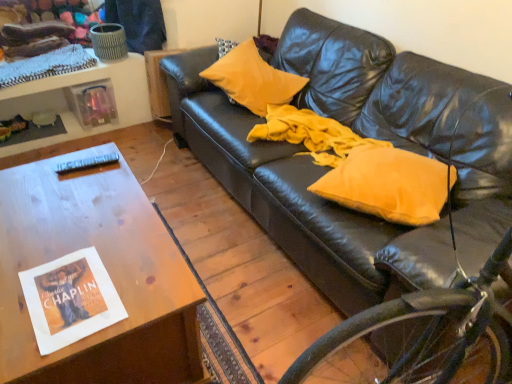
What is the approximate height of black plastic remote control at upper left?

black plastic remote control at upper left is 3.34 centimeters in height.

Where is `black plastic remote control at upper left`? This screenshot has height=384, width=512. black plastic remote control at upper left is located at coordinates (86, 163).

The height and width of the screenshot is (384, 512). What do you see at coordinates (70, 299) in the screenshot?
I see `white paper magazine at lower left` at bounding box center [70, 299].

Measure the distance between woodenwoodentable at left and camera.

The distance of woodenwoodentable at left from camera is 92.90 centimeters.

Identify the location of leather couch at center. This screenshot has height=384, width=512. (412, 115).

Considering the relative positions of yellow fabric pillow at center, which is the 1th pillow in front-to-back order, and yellow matte pillow at upper center, arranged as the 1th pillow when viewed from the back, in the image provided, is yellow fabric pillow at center, which is the 1th pillow in front-to-back order, to the right of yellow matte pillow at upper center, arranged as the 1th pillow when viewed from the back, from the viewer's perspective?

Correct, you'll find yellow fabric pillow at center, which is the 1th pillow in front-to-back order, to the right of yellow matte pillow at upper center, arranged as the 1th pillow when viewed from the back.

Does yellow fabric pillow at center, which is the 2th pillow in back-to-front order, have a larger size compared to yellow matte pillow at upper center, the 1th pillow positioned from the left?

No.

Where is `pillow that is on the left side of yellow fabric pillow at center, which is the 2th pillow in back-to-front order`? pillow that is on the left side of yellow fabric pillow at center, which is the 2th pillow in back-to-front order is located at coordinates (253, 79).

Does point (435, 187) lie in front of point (246, 55)?

That is True.

Are yellow matte pillow at upper center, arranged as the 1th pillow when viewed from the back, and yellow fabric pillow at center, which is the 2th pillow from top to bottom, far apart?

No.

The height and width of the screenshot is (384, 512). Find the location of `pillow on the right of yellow matte pillow at upper center, the 1th pillow positioned from the left`. pillow on the right of yellow matte pillow at upper center, the 1th pillow positioned from the left is located at coordinates (389, 184).

What's the angular difference between yellow matte pillow at upper center, the first pillow positioned from the top, and yellow fabric pillow at center, which is the second pillow from left to right,'s facing directions?

The facing directions of yellow matte pillow at upper center, the first pillow positioned from the top, and yellow fabric pillow at center, which is the second pillow from left to right, are 8.66 degrees apart.

How many degrees apart are the facing directions of yellow matte pillow at upper center, which is the 2th pillow in right-to-left order, and black plastic remote control at upper left?

The facing directions of yellow matte pillow at upper center, which is the 2th pillow in right-to-left order, and black plastic remote control at upper left are 26.3 degrees apart.

From the picture: From a real-world perspective, is yellow matte pillow at upper center, which is the 2th pillow in right-to-left order, physically located above or below black plastic remote control at upper left?

yellow matte pillow at upper center, which is the 2th pillow in right-to-left order, is situated lower than black plastic remote control at upper left in the real world.

Which is more to the right, yellow matte pillow at upper center, which ranks as the 2th pillow in front-to-back order, or black plastic remote control at upper left?

Positioned to the right is yellow matte pillow at upper center, which ranks as the 2th pillow in front-to-back order.

Is black plastic remote control at upper left located within yellow matte pillow at upper center, the first pillow positioned from the top?

That's incorrect, black plastic remote control at upper left is not inside yellow matte pillow at upper center, the first pillow positioned from the top.

Would you consider yellow fabric pillow at center, which is the 2th pillow in back-to-front order, to be distant from black plastic remote control at upper left?

yellow fabric pillow at center, which is the 2th pillow in back-to-front order, is positioned a significant distance from black plastic remote control at upper left.

From a real-world perspective, which is physically below, yellow fabric pillow at center, which is the 2th pillow in back-to-front order, or black plastic remote control at upper left?

From a 3D spatial view, yellow fabric pillow at center, which is the 2th pillow in back-to-front order, is below.

Can you confirm if yellow fabric pillow at center, which is the 2th pillow from top to bottom, is bigger than black plastic remote control at upper left?

Yes, yellow fabric pillow at center, which is the 2th pillow from top to bottom, is bigger than black plastic remote control at upper left.

Which point is more distant from viewer, (411,197) or (74,165)?

Positioned behind is point (74,165).

Which object is closer to the camera, white paper magazine at lower left or black plastic remote control at upper left?

white paper magazine at lower left is closer to the camera.

Is white paper magazine at lower left not near black plastic remote control at upper left?

No, white paper magazine at lower left is not far from black plastic remote control at upper left.

How different are the orientations of white paper magazine at lower left and black plastic remote control at upper left in degrees?

There is a 101-degree angle between the facing directions of white paper magazine at lower left and black plastic remote control at upper left.

Could you measure the distance between white paper magazine at lower left and black plastic remote control at upper left?

white paper magazine at lower left is 22.39 inches away from black plastic remote control at upper left.

From the image's perspective, does white paper magazine at lower left appear lower than leather couch at center?

Answer: Indeed, from the image's perspective, white paper magazine at lower left is shown beneath leather couch at center.

In the scene shown: From a real-world perspective, who is located higher, white paper magazine at lower left or leather couch at center?

leather couch at center, from a real-world perspective.

Can you confirm if white paper magazine at lower left is positioned to the left of leather couch at center?

Correct, you'll find white paper magazine at lower left to the left of leather couch at center.

From a real-world perspective, who is located lower, woodenwoodentable at left or yellow matte pillow at upper center, which ranks as the 2th pillow in front-to-back order?

From a 3D spatial view, woodenwoodentable at left is below.

Considering the relative positions of woodenwoodentable at left and yellow matte pillow at upper center, the first pillow positioned from the top, in the image provided, is woodenwoodentable at left to the right of yellow matte pillow at upper center, the first pillow positioned from the top, from the viewer's perspective?

No, woodenwoodentable at left is not to the right of yellow matte pillow at upper center, the first pillow positioned from the top.

Are woodenwoodentable at left and yellow matte pillow at upper center, the 2th pillow in the bottom-to-top sequence, beside each other?

woodenwoodentable at left and yellow matte pillow at upper center, the 2th pillow in the bottom-to-top sequence, are not in contact.

Find the location of `pillow located on the right of yellow matte pillow at upper center, which is the 2th pillow in right-to-left order`. pillow located on the right of yellow matte pillow at upper center, which is the 2th pillow in right-to-left order is located at coordinates (389, 184).

The width and height of the screenshot is (512, 384). What are the coordinates of `pillow located behind the yellow fabric pillow at center, which is the 2th pillow in back-to-front order` in the screenshot? It's located at (253, 79).

Consider the image. Based on their spatial positions, is leather couch at center or yellow matte pillow at upper center, which ranks as the 2th pillow in front-to-back order, closer to black plastic remote control at upper left?

Based on the image, yellow matte pillow at upper center, which ranks as the 2th pillow in front-to-back order, appears to be nearer to black plastic remote control at upper left.

Estimate the real-world distances between objects in this image. Which object is closer to yellow matte pillow at upper center, the 1th pillow positioned from the left, woodenwoodentable at left or yellow fabric pillow at center, which is the first pillow in bottom-to-top order?

yellow fabric pillow at center, which is the first pillow in bottom-to-top order.

When comparing their distances from black plastic remote control at upper left, does white paper magazine at lower left or yellow matte pillow at upper center, arranged as the 1th pillow when viewed from the back, seem further?

yellow matte pillow at upper center, arranged as the 1th pillow when viewed from the back, lies further to black plastic remote control at upper left than the other object.

When comparing their distances from yellow matte pillow at upper center, which ranks as the 2th pillow in front-to-back order, does woodenwoodentable at left or white paper magazine at lower left seem closer?

The object closer to yellow matte pillow at upper center, which ranks as the 2th pillow in front-to-back order, is woodenwoodentable at left.

Looking at the image, which one is located further to yellow matte pillow at upper center, arranged as the 1th pillow when viewed from the back, yellow fabric pillow at center, which is the 1th pillow in front-to-back order, or leather couch at center?

Based on the image, yellow fabric pillow at center, which is the 1th pillow in front-to-back order, appears to be further to yellow matte pillow at upper center, arranged as the 1th pillow when viewed from the back.

Consider the image. Estimate the real-world distances between objects in this image. Which object is closer to leather couch at center, white paper magazine at lower left or black plastic remote control at upper left?

Among the two, black plastic remote control at upper left is located nearer to leather couch at center.

Estimate the real-world distances between objects in this image. Which object is further from yellow matte pillow at upper center, which ranks as the 2th pillow in front-to-back order, yellow fabric pillow at center, which is the first pillow in bottom-to-top order, or woodenwoodentable at left?

Based on the image, woodenwoodentable at left appears to be further to yellow matte pillow at upper center, which ranks as the 2th pillow in front-to-back order.

Which object lies nearer to the anchor point black plastic remote control at upper left, yellow fabric pillow at center, which is the first pillow in bottom-to-top order, or white paper magazine at lower left?

white paper magazine at lower left is closer to black plastic remote control at upper left.

I want to click on magazine between woodenwoodentable at left and yellow matte pillow at upper center, the first pillow positioned from the top, in the front-back direction, so click(x=70, y=299).

At what (x,y) coordinates should I click in order to perform the action: click on magazine between black plastic remote control at upper left and leather couch at center in the horizontal direction. Please return your answer as a coordinate pair (x, y). The image size is (512, 384). Looking at the image, I should click on (70, 299).

You are a GUI agent. You are given a task and a screenshot of the screen. Output one action in this format:
    pyautogui.click(x=<x>, y=<y>)
    Task: Click on the magazine between black plastic remote control at upper left and yellow fabric pillow at center, which is the 2th pillow from top to bottom
    
    Given the screenshot: What is the action you would take?
    pyautogui.click(x=70, y=299)

Image resolution: width=512 pixels, height=384 pixels. In order to click on remote control positioned between leather couch at center and yellow matte pillow at upper center, which ranks as the 2th pillow in front-to-back order, from near to far in this screenshot , I will do `click(86, 163)`.